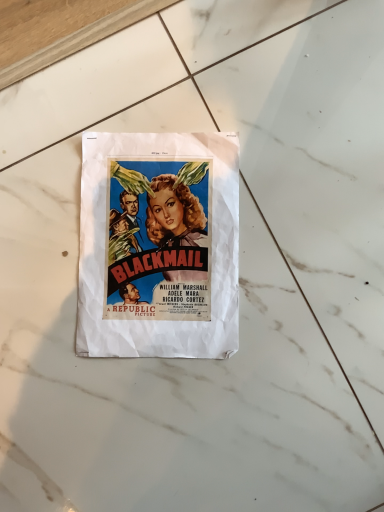
The width and height of the screenshot is (384, 512). Identify the location of free spot above matte paper poster at center (from a real-world perspective). (164, 238).